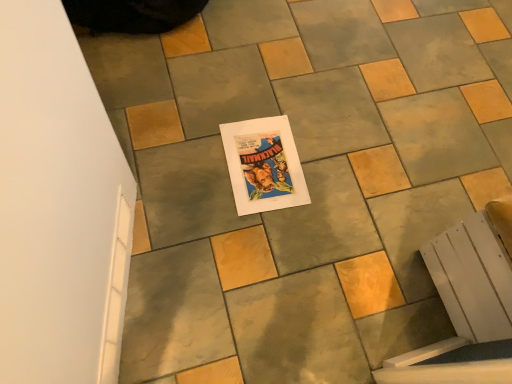
Locate an element on the screen. The width and height of the screenshot is (512, 384). vacant point to the right of vibrant paper comic book at center is located at coordinates (339, 181).